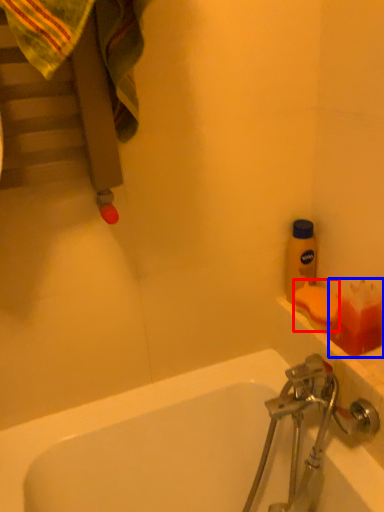
Question: Which object is further to the camera taking this photo, soap (highlighted by a red box) or toiletry (highlighted by a blue box)?

Choices:
 (A) soap
 (B) toiletry

Answer: (A)